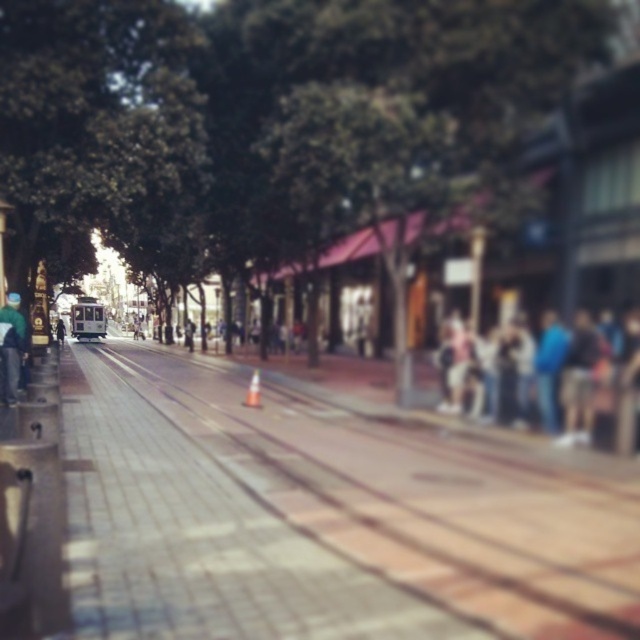
Question: Is blue denim jeans at center right bigger than green fabric jacket at left?

Choices:
 (A) yes
 (B) no

Answer: (A)

Question: Can you confirm if blue denim jeans at center right is positioned to the right of dark blue jacket at center?

Choices:
 (A) no
 (B) yes

Answer: (B)

Question: Considering the real-world distances, which object is closest to the green fabric jacket at left?

Choices:
 (A) blue denim jeans at center right
 (B) brick paved train track at left

Answer: (B)

Question: Which of the following is the farthest from the observer?

Choices:
 (A) brick paved train track at left
 (B) dark blue jacket at center
 (C) green fabric jacket at left
 (D) blue denim jeans at center right

Answer: (B)

Question: Which object appears farthest from the camera in this image?

Choices:
 (A) blue denim jeans at center right
 (B) brick paved train track at left
 (C) dark blue jacket at center
 (D) green fabric jacket at left

Answer: (C)

Question: Is brick paved train track at left to the left of blue denim jeans at center right from the viewer's perspective?

Choices:
 (A) no
 (B) yes

Answer: (B)